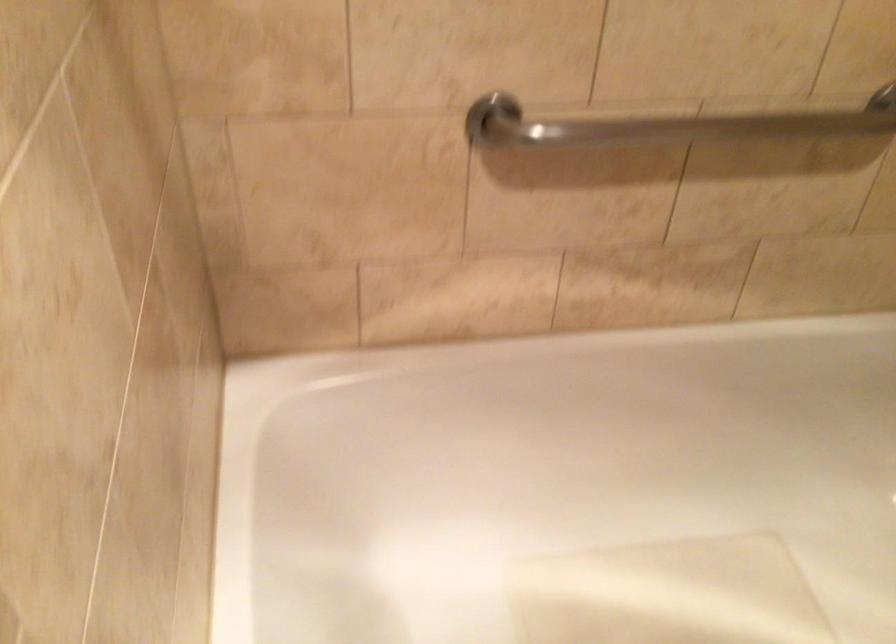
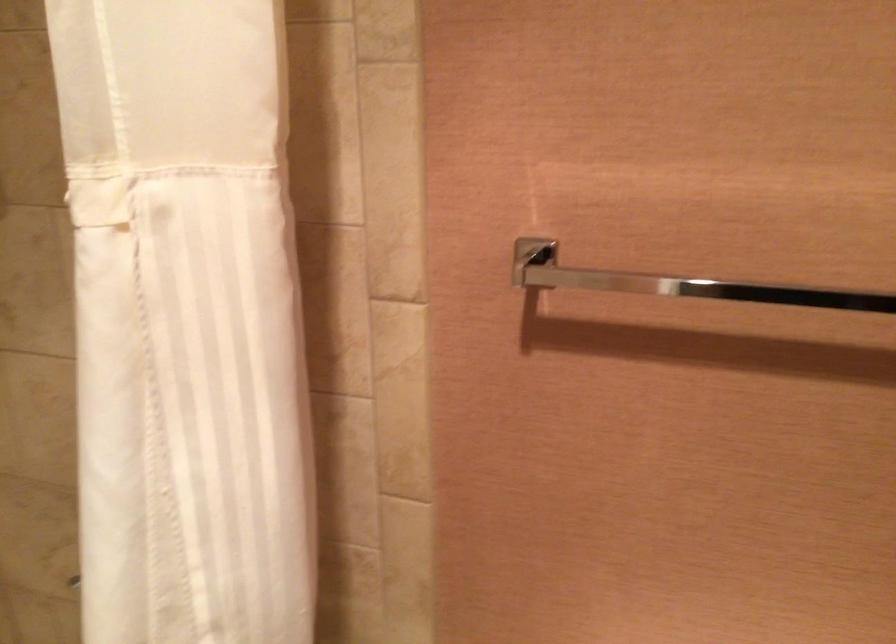
Question: The first image is from the beginning of the video and the second image is from the end. How did the camera likely rotate when shooting the video?

Choices:
 (A) Left
 (B) Right
 (C) Up
 (D) Down

Answer: (B)